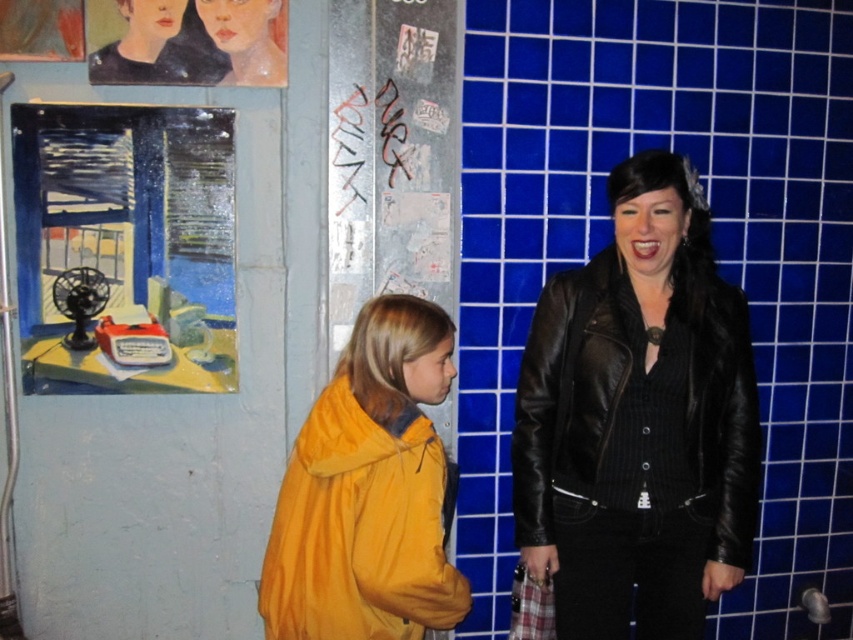
Question: From the image, what is the correct spatial relationship of yellow matte jacket at center in relation to black leather jacket at right?

Choices:
 (A) right
 (B) left

Answer: (B)

Question: Which point is closer to the camera taking this photo?

Choices:
 (A) (544, 326)
 (B) (459, 573)

Answer: (B)

Question: Does yellow matte jacket at center lie behind black leather jacket at right?

Choices:
 (A) no
 (B) yes

Answer: (A)

Question: Is yellow matte jacket at center positioned behind black leather jacket at right?

Choices:
 (A) yes
 (B) no

Answer: (B)

Question: Which point is closer to the camera?

Choices:
 (A) black leather jacket at right
 (B) yellow matte jacket at center

Answer: (B)

Question: Among these objects, which one is nearest to the camera?

Choices:
 (A) black leather jacket at right
 (B) yellow matte jacket at center

Answer: (B)